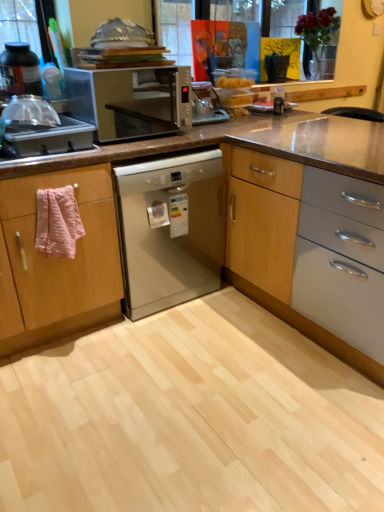
Question: Do you think metallic silver microwave at center is within matte black bottle at left, marked as the first kitchen appliance in a top-to-bottom arrangement, or outside of it?

Choices:
 (A) inside
 (B) outside

Answer: (B)

Question: Looking at their shapes, would you say metallic silver microwave at center is wider or thinner than matte black bottle at left, which is the 2th kitchen appliance from bottom to top?

Choices:
 (A) wide
 (B) thin

Answer: (A)

Question: Which is nearer to the pink fabric towel at left?

Choices:
 (A) metallic silver microwave at center
 (B) satin silver dishwasher at center
 (C) pink textured towel at left
 (D) wooden cabinet at center
 (E) matte black bottle at left, which is the 2th kitchen appliance from bottom to top

Answer: (C)

Question: Estimate the real-world distances between objects in this image. Which object is farther from the metallic silver microwave at center?

Choices:
 (A) pink fabric towel at left
 (B) satin silver dishwasher at center
 (C) brushed metal sink at left, the second kitchen appliance positioned from the top
 (D) pink textured towel at left
 (E) matte black bottle at left, which is the 2th kitchen appliance from bottom to top

Answer: (D)